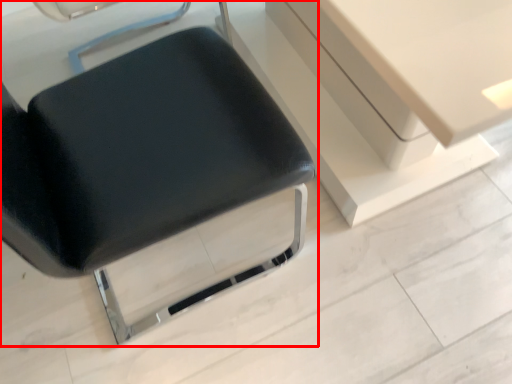
Question: From the image's perspective, what is the correct spatial relationship of chair (annotated by the red box) in relation to vanity?

Choices:
 (A) below
 (B) above

Answer: (A)